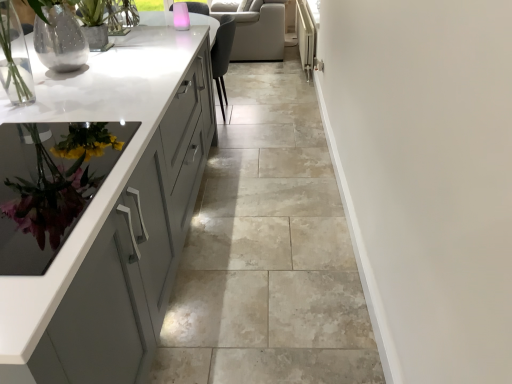
What do you see at coordinates (268, 251) in the screenshot? I see `white glossy countertop at upper left` at bounding box center [268, 251].

Where is `white glossy countertop at upper left`? The width and height of the screenshot is (512, 384). white glossy countertop at upper left is located at coordinates (268, 251).

I want to click on white glossy countertop at upper left, so click(x=268, y=251).